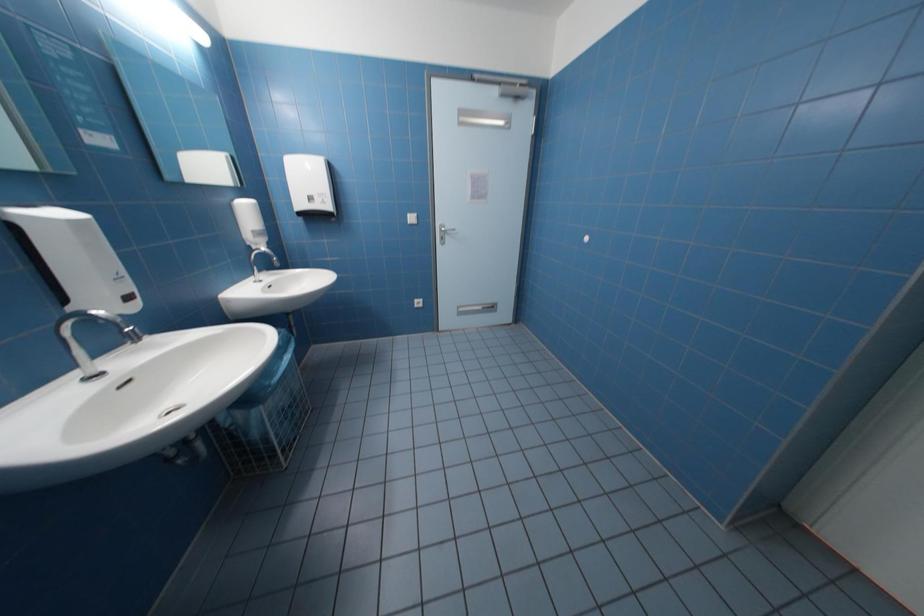
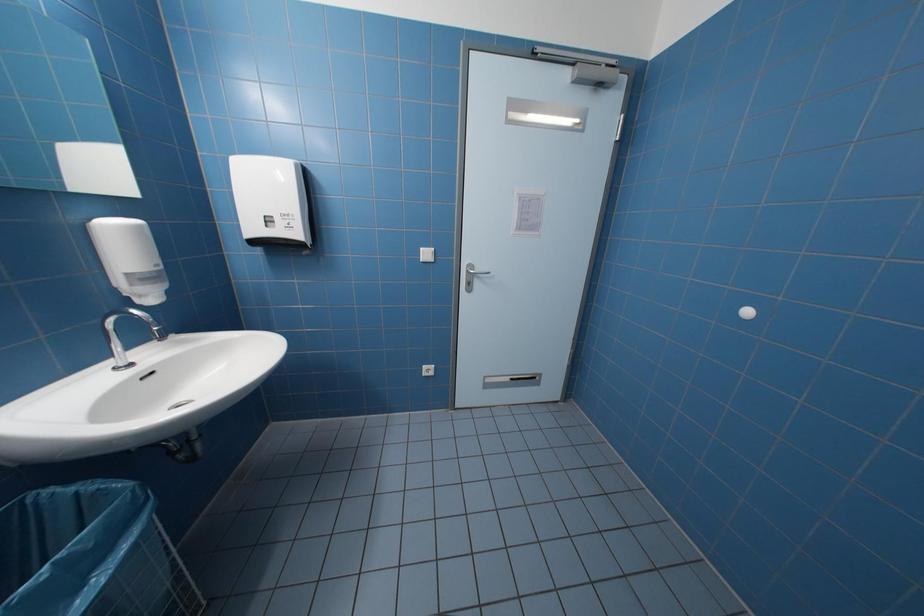
Question: The images are taken continuously from a first-person perspective. In which direction are you moving?

Choices:
 (A) Left
 (B) Right
 (C) Forward
 (D) Backward

Answer: (C)